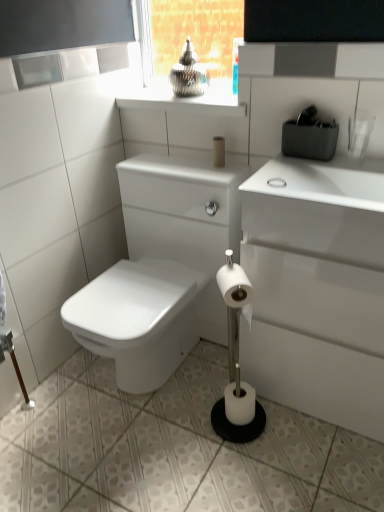
Where is `unoccupied region to the right of white matte toilet paper at center, the 1th toilet paper when ordered from bottom to top`? Image resolution: width=384 pixels, height=512 pixels. unoccupied region to the right of white matte toilet paper at center, the 1th toilet paper when ordered from bottom to top is located at coordinates (281, 424).